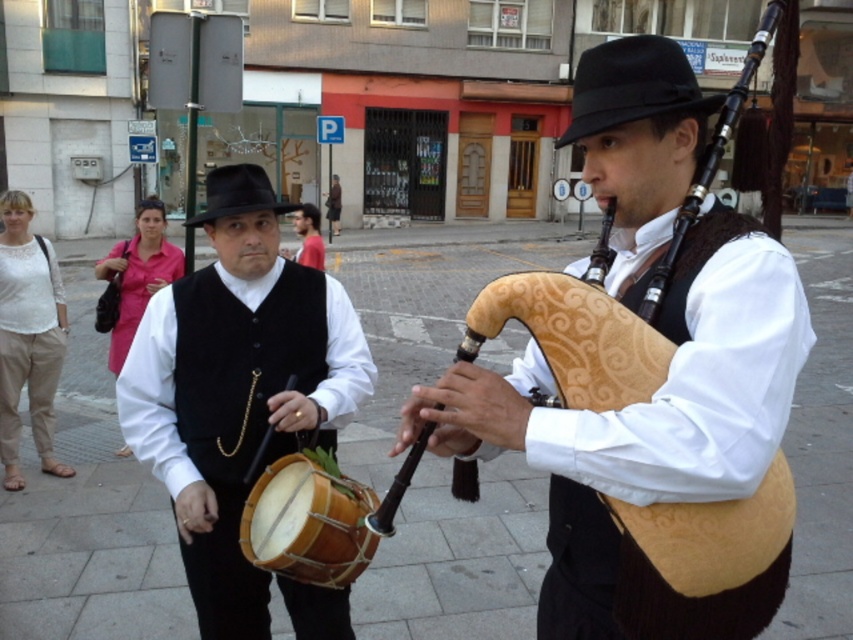
Question: Observing the image, what is the correct spatial positioning of gray stone pavement at center in reference to black felt fedora at center?

Choices:
 (A) left
 (B) right

Answer: (A)

Question: Considering the real-world distances, which object is closest to the natural wood drum at center?

Choices:
 (A) matte black vest at center
 (B) black felt fedora at left
 (C) matte black bagpipe at center

Answer: (A)

Question: Which is farther from the matte white blouse at left?

Choices:
 (A) natural wood drum at center
 (B) matte black vest at center
 (C) matte black bagpipe at center

Answer: (C)

Question: Can you confirm if gray stone pavement at center is thinner than matte black vest at center?

Choices:
 (A) no
 (B) yes

Answer: (A)

Question: Which point is farther from the camera taking this photo?

Choices:
 (A) (784, 376)
 (B) (648, 115)

Answer: (B)

Question: From the image, what is the correct spatial relationship of matte white blouse at left in relation to black felt fedora at left?

Choices:
 (A) right
 (B) left

Answer: (A)